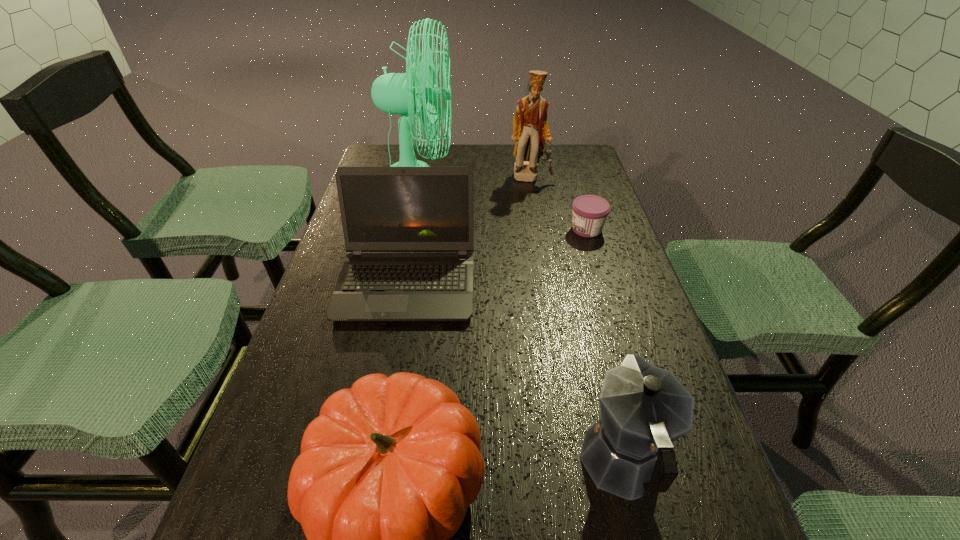
Find the location of a particular element. The height and width of the screenshot is (540, 960). free space located at the spout of the coffeepot is located at coordinates (587, 318).

Find the location of a particular element. The image size is (960, 540). vacant region located at the spout of the coffeepot is located at coordinates (587, 318).

This screenshot has width=960, height=540. Identify the location of free region located 0.140m on the front label of the jam. (517, 229).

This screenshot has width=960, height=540. In order to click on blank area located 0.270m on the front label of the jam in this screenshot , I will do `click(470, 229)`.

Identify the location of blank space located on the front label of the jam. The image size is (960, 540). (540, 229).

Where is `fan that is positioned at the far edge`? The width and height of the screenshot is (960, 540). fan that is positioned at the far edge is located at coordinates (395, 93).

Locate an element on the screen. nutcracker situated at the far edge is located at coordinates (531, 132).

The image size is (960, 540). What are the coordinates of `fan positioned at the left edge` in the screenshot? It's located at (395, 93).

Where is `laptop_computer at the left edge`? The height and width of the screenshot is (540, 960). laptop_computer at the left edge is located at coordinates (409, 230).

Identify the location of nutcracker at the right edge. This screenshot has height=540, width=960. (531, 132).